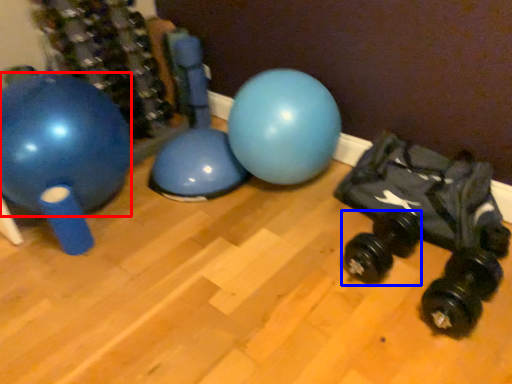
Question: Which point is further to the camera, ball (highlighted by a red box) or dumbbell (highlighted by a blue box)?

Choices:
 (A) ball
 (B) dumbbell

Answer: (B)